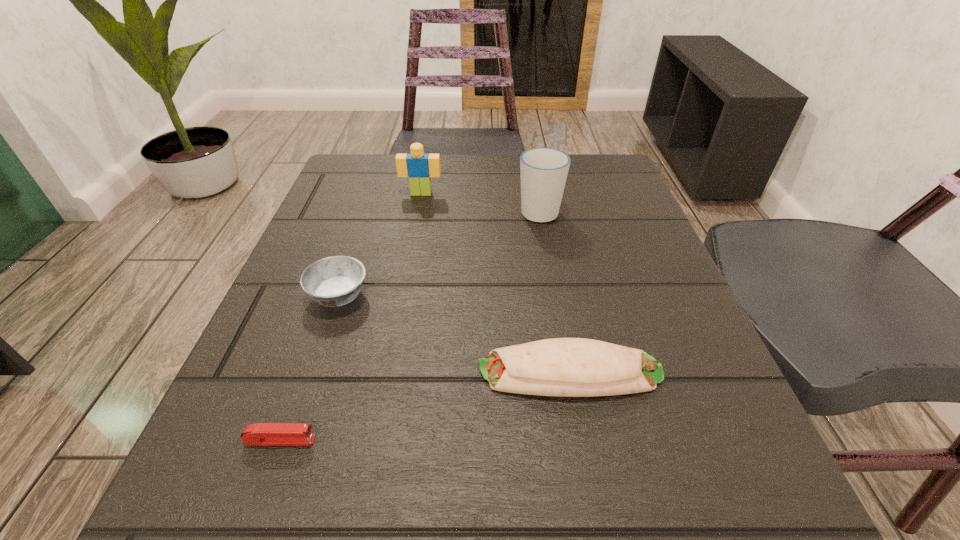
Where is `vacant space at the far left corner`? Image resolution: width=960 pixels, height=540 pixels. vacant space at the far left corner is located at coordinates (380, 174).

This screenshot has height=540, width=960. Find the location of `free spot at the near left corner of the desktop`. free spot at the near left corner of the desktop is located at coordinates (290, 469).

Where is `vacant space at the near right corner`? The width and height of the screenshot is (960, 540). vacant space at the near right corner is located at coordinates (756, 484).

At what (x,y) coordinates should I click in order to perform the action: click on free area in between the second shortest object and the shortest object. Please return your answer as a coordinate pair (x, y). This screenshot has width=960, height=540. Looking at the image, I should click on (425, 406).

You are a GUI agent. You are given a task and a screenshot of the screen. Output one action in this format:
    pyautogui.click(x=<x>, y=<y>)
    Task: Click on the free space between the burrito and the Lego
    This screenshot has height=540, width=960.
    Given the screenshot: What is the action you would take?
    pyautogui.click(x=495, y=283)

The height and width of the screenshot is (540, 960). Identify the location of blank region between the third object from right to left and the shortest object. (351, 317).

Locate an element on the screen. The width and height of the screenshot is (960, 540). empty space between the Lego and the second shortest object is located at coordinates (495, 283).

Identify the location of vacant region between the shortest object and the cup. (410, 326).

You are a GUI agent. You are given a task and a screenshot of the screen. Output one action in this format:
    pyautogui.click(x=<x>, y=<y>)
    Task: Click on the empty location between the Lego and the third shortest object
    The image size is (960, 540).
    Given the screenshot: What is the action you would take?
    pyautogui.click(x=380, y=245)

Where is `free space between the ashtray and the third object from left to right`? The height and width of the screenshot is (540, 960). free space between the ashtray and the third object from left to right is located at coordinates (380, 245).